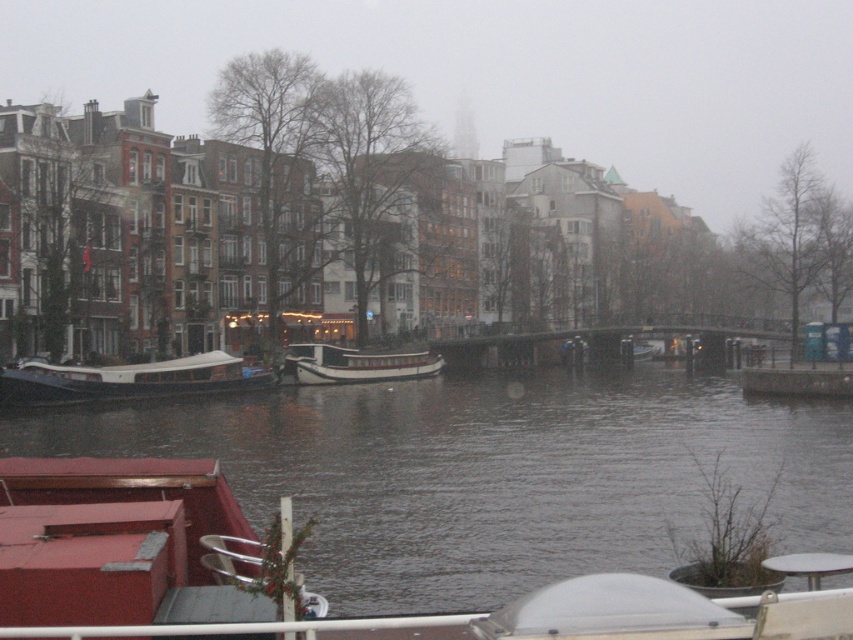
Question: Which point is farther from the camera taking this photo?

Choices:
 (A) pos(347,600)
 (B) pos(380,376)

Answer: (B)

Question: Which of these objects is positioned farthest from the wooden polished boat at left?

Choices:
 (A) dark gray water at center
 (B) white wooden boat at center

Answer: (A)

Question: Is wooden polished boat at left below white wooden boat at center?

Choices:
 (A) no
 (B) yes

Answer: (B)

Question: Which point is farther from the camera taking this photo?

Choices:
 (A) (308, 369)
 (B) (438, 456)
 (C) (97, 378)

Answer: (A)

Question: Is dark gray water at center closer to the viewer compared to white wooden boat at center?

Choices:
 (A) no
 (B) yes

Answer: (B)

Question: Is dark gray water at center above wooden polished boat at left?

Choices:
 (A) no
 (B) yes

Answer: (A)